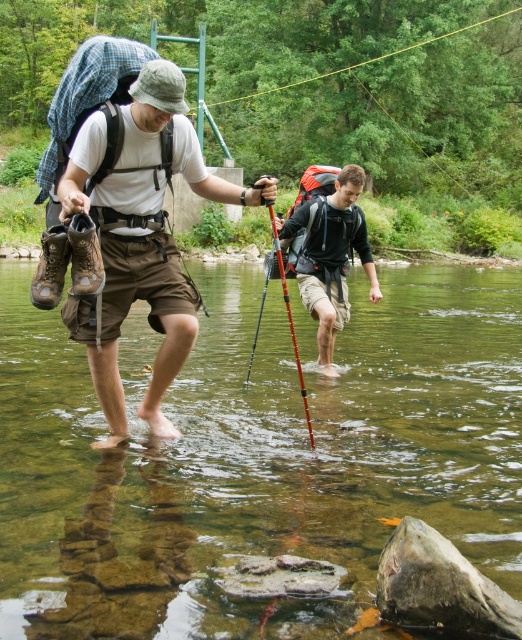
Question: Which object appears farthest from the camera in this image?

Choices:
 (A) clear water at center
 (B) red plastic pole at center
 (C) matte brown shorts at center

Answer: (B)

Question: Does matte brown shorts at center appear on the right side of red plastic pole at center?

Choices:
 (A) no
 (B) yes

Answer: (A)

Question: Is clear water at center further to the viewer compared to red plastic pole at center?

Choices:
 (A) yes
 (B) no

Answer: (B)

Question: Which is farther from the red plastic pole at center?

Choices:
 (A) matte brown shorts at center
 (B) clear water at center

Answer: (B)

Question: Does clear water at center appear over matte brown shorts at center?

Choices:
 (A) no
 (B) yes

Answer: (A)

Question: Among these points, which one is farthest from the camera?

Choices:
 (A) (409, 429)
 (B) (279, 273)

Answer: (A)